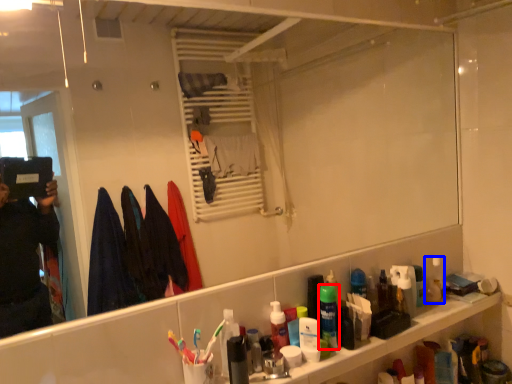
Question: Which of the following is the farthest to the observer, mouthwash (highlighted by a red box) or mouthwash (highlighted by a blue box)?

Choices:
 (A) mouthwash
 (B) mouthwash

Answer: (B)